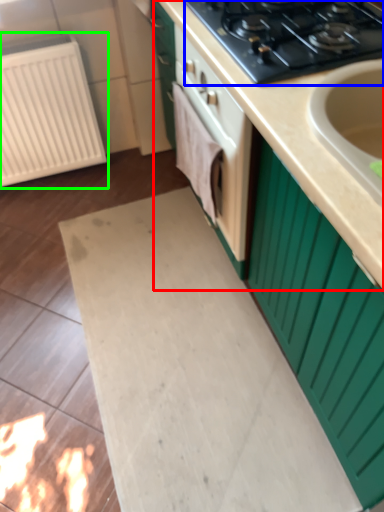
Question: Considering the real-world distances, which object is farthest from countertop (highlighted by a red box)? gas stove (highlighted by a blue box) or radiator (highlighted by a green box)?

Choices:
 (A) gas stove
 (B) radiator

Answer: (B)